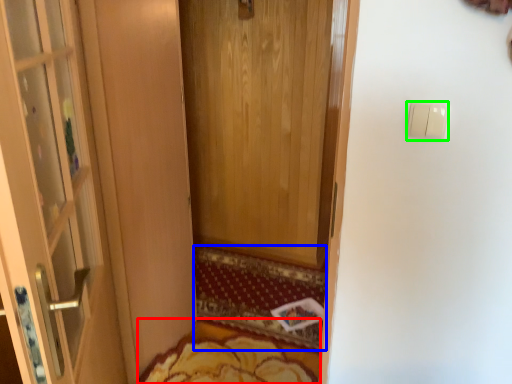
Question: Estimate the real-world distances between objects in this image. Which object is farther from mat (highlighted by a red box), doormat (highlighted by a blue box) or light switch (highlighted by a green box)?

Choices:
 (A) doormat
 (B) light switch

Answer: (B)